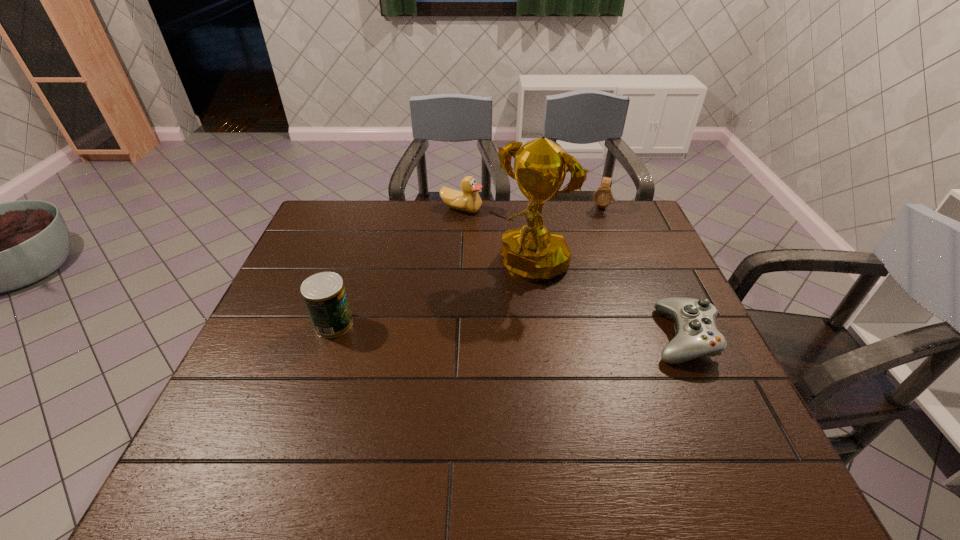
The width and height of the screenshot is (960, 540). What are the coordinates of `control that is positioned at the right edge` in the screenshot? It's located at coord(697,335).

Find the location of a particular element. The width and height of the screenshot is (960, 540). watch that is at the right edge is located at coordinates (603, 196).

Where is `object that is at the far right corner`? The width and height of the screenshot is (960, 540). object that is at the far right corner is located at coordinates (603, 196).

In the image, there is a desktop. Where is `vacant region at the far edge`? The image size is (960, 540). vacant region at the far edge is located at coordinates (436, 229).

Locate an element on the screen. This screenshot has height=540, width=960. free space at the near edge of the desktop is located at coordinates (x=368, y=427).

At what (x,y) coordinates should I click in order to perform the action: click on vacant space at the right edge of the desktop. Please return your answer as a coordinate pair (x, y). The width and height of the screenshot is (960, 540). Looking at the image, I should click on (691, 381).

At what (x,y) coordinates should I click in order to perform the action: click on free spot at the far left corner of the desktop. Please return your answer as a coordinate pair (x, y). The image size is (960, 540). Looking at the image, I should click on (354, 221).

Image resolution: width=960 pixels, height=540 pixels. In order to click on vacant region at the far right corner of the desktop in this screenshot , I will do `click(623, 206)`.

Locate an element on the screen. vacant space at the near right corner of the desktop is located at coordinates (688, 406).

Find the location of a particular element. The width and height of the screenshot is (960, 540). empty location between the duck and the can is located at coordinates (397, 266).